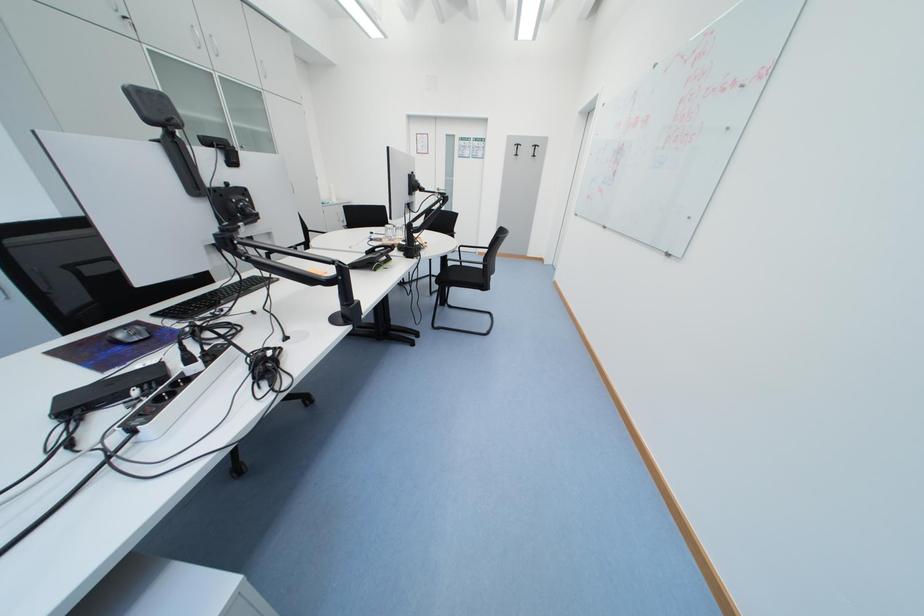
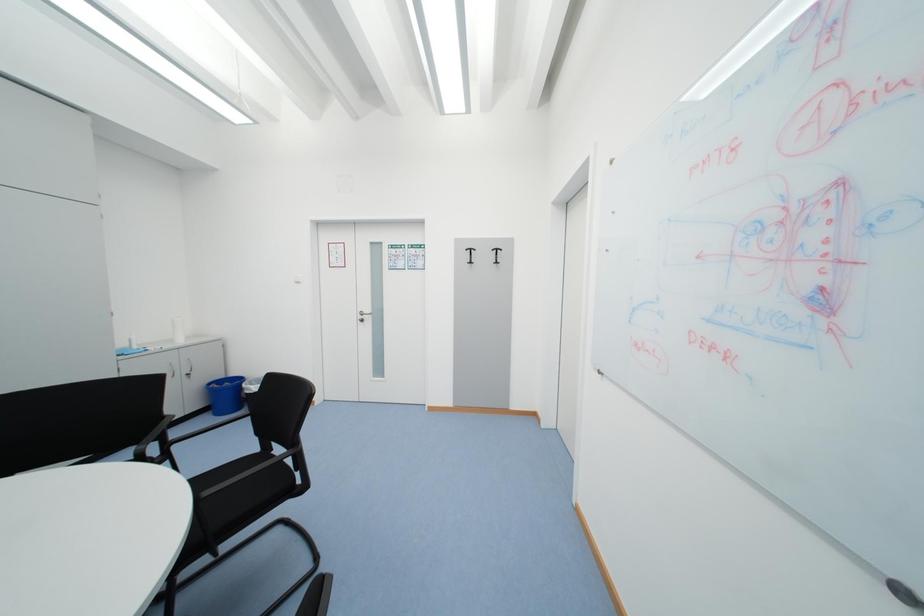
What movement of the cameraman would produce the second image?

The cameraman moved toward right, forward.